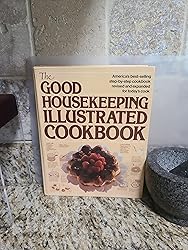
Identify the location of wall. (173, 106).